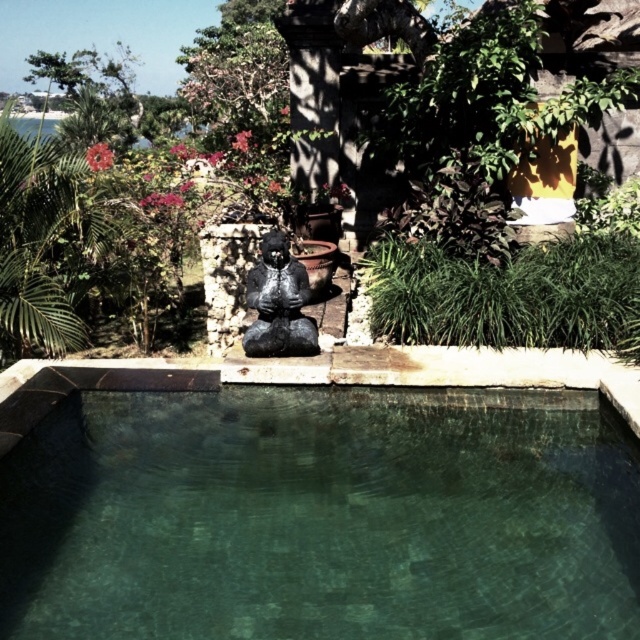
Question: Can you confirm if green leafy plant at center is smaller than black matte statue at center?

Choices:
 (A) no
 (B) yes

Answer: (A)

Question: Is green mosaic tiles at center behind green leafy plant at center?

Choices:
 (A) no
 (B) yes

Answer: (A)

Question: Which point appears farthest from the camera in this image?

Choices:
 (A) (284, 326)
 (B) (74, 412)

Answer: (A)

Question: Which object appears farthest from the camera in this image?

Choices:
 (A) green leafy plant at center
 (B) green mosaic tiles at center
 (C) black matte statue at center

Answer: (A)

Question: Which point is closer to the camera taking this photo?

Choices:
 (A) [596, 401]
 (B) [262, 234]
 (C) [497, 298]

Answer: (A)

Question: Is green mosaic tiles at center positioned at the back of black matte statue at center?

Choices:
 (A) yes
 (B) no

Answer: (B)